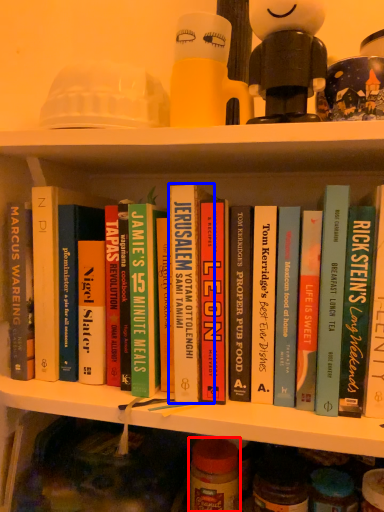
Question: Which of the following is the farthest to the observer, glass jar (highlighted by a red box) or book (highlighted by a blue box)?

Choices:
 (A) glass jar
 (B) book

Answer: (A)